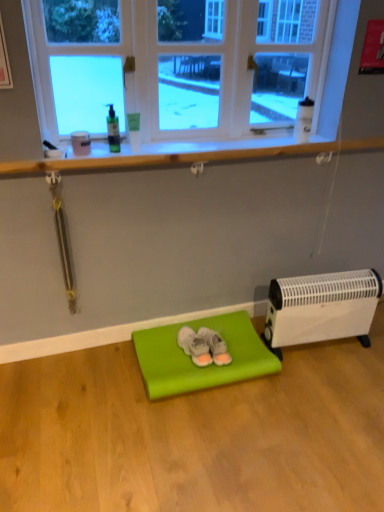
I want to click on vacant space to the left of white suede sneakers at center, which is the 1th footwear in right-to-left order, so click(x=174, y=351).